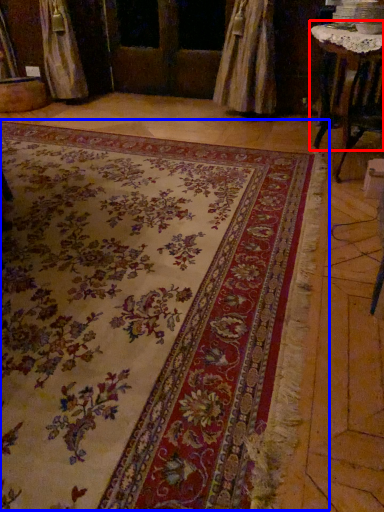
Question: Which of the following is the farthest to the observer, table (highlighted by a red box) or mat (highlighted by a blue box)?

Choices:
 (A) table
 (B) mat

Answer: (A)